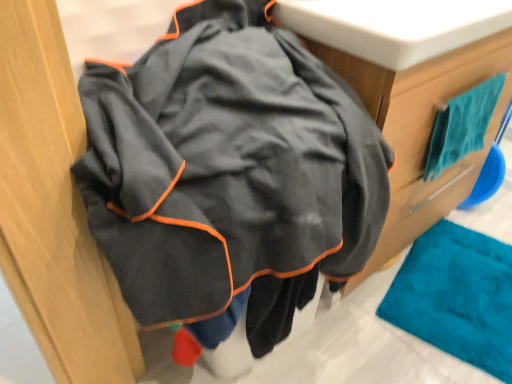
Question: Considering the positions of point (475, 122) and point (349, 46), is point (475, 122) closer or farther from the camera than point (349, 46)?

Choices:
 (A) closer
 (B) farther

Answer: (B)

Question: Is teal fabric towel at upper right wider or thinner than teal fabric towel at upper right?

Choices:
 (A) thin
 (B) wide

Answer: (A)

Question: From a real-world perspective, is teal fabric towel at upper right positioned above or below teal fabric towel at upper right?

Choices:
 (A) below
 (B) above

Answer: (B)

Question: Is teal fabric towel at upper right inside the boundaries of teal fabric towel at upper right, or outside?

Choices:
 (A) outside
 (B) inside

Answer: (A)

Question: Does point (449, 33) appear closer or farther from the camera than point (450, 119)?

Choices:
 (A) farther
 (B) closer

Answer: (B)

Question: Looking at their shapes, would you say teal fabric towel at upper right is wider or thinner than teal fabric towel at upper right?

Choices:
 (A) thin
 (B) wide

Answer: (B)

Question: Based on their sizes in the image, would you say teal fabric towel at upper right is bigger or smaller than teal fabric towel at upper right?

Choices:
 (A) big
 (B) small

Answer: (A)